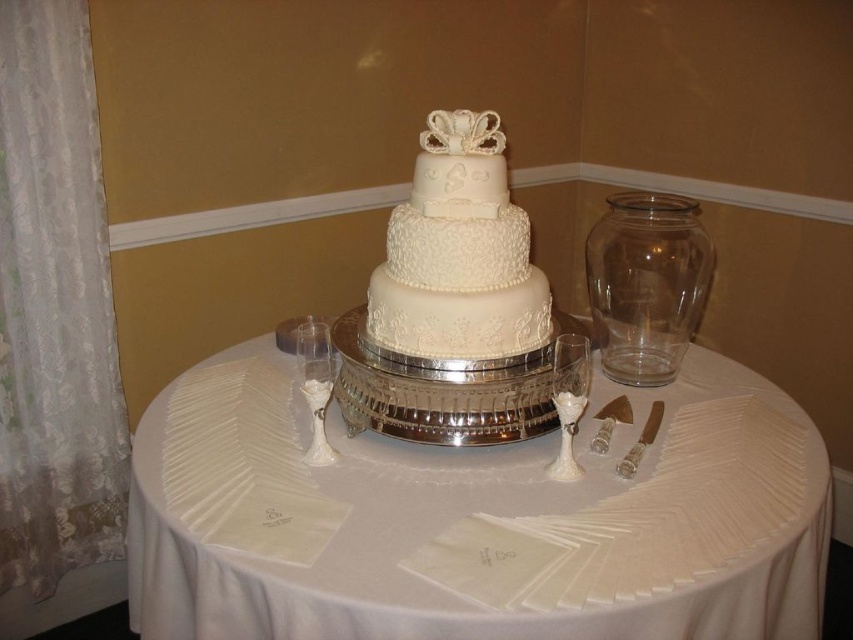
Consider the image. Can you confirm if white satin tablecloth at center is thinner than white porcelain wine glass at center-left?

No, white satin tablecloth at center is not thinner than white porcelain wine glass at center-left.

Does white satin tablecloth at center have a greater height compared to white porcelain wine glass at center-left?

Yes, white satin tablecloth at center is taller than white porcelain wine glass at center-left.

Does point (299, 422) come behind point (321, 401)?

Yes, it is.

At what (x,y) coordinates should I click in order to perform the action: click on white satin tablecloth at center. Please return your answer as a coordinate pair (x, y). Looking at the image, I should click on (471, 518).

Is gold metallic knife at center in front of shiny silver knife at right?

No, it is behind shiny silver knife at right.

Between gold metallic knife at center and shiny silver knife at right, which one has less height?

gold metallic knife at center is shorter.

Between point (602, 426) and point (630, 452), which one is positioned in front?

Positioned in front is point (630, 452).

Locate an element on the screen. The height and width of the screenshot is (640, 853). gold metallic knife at center is located at coordinates (610, 420).

Is point (471, 234) farther from viewer compared to point (318, 422)?

Yes, point (471, 234) is behind point (318, 422).

Is white textured cake at center smaller than white porcelain wine glass at center-left?

Actually, white textured cake at center might be larger than white porcelain wine glass at center-left.

At what (x,y) coordinates should I click in order to perform the action: click on white textured cake at center. Please return your answer as a coordinate pair (x, y). The height and width of the screenshot is (640, 853). Looking at the image, I should click on (457, 253).